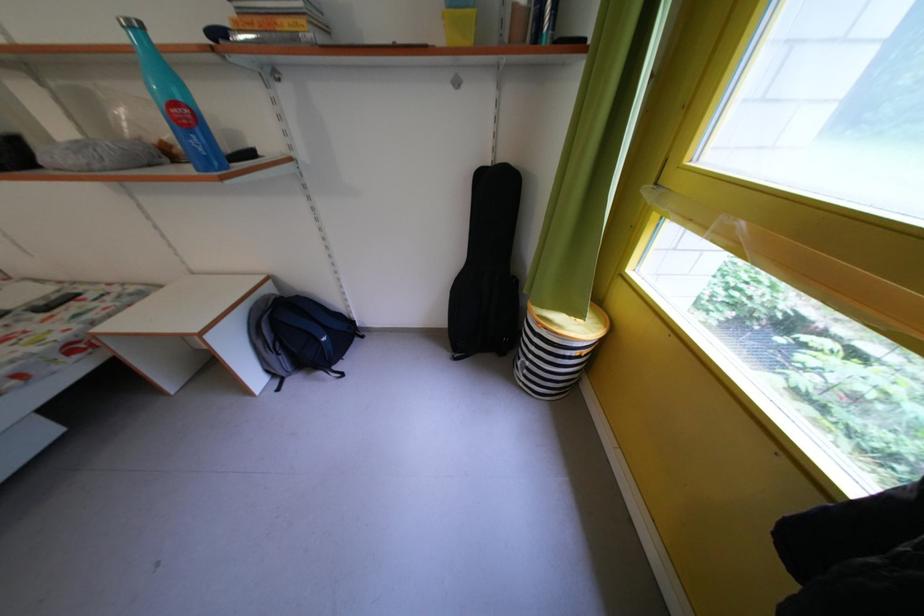
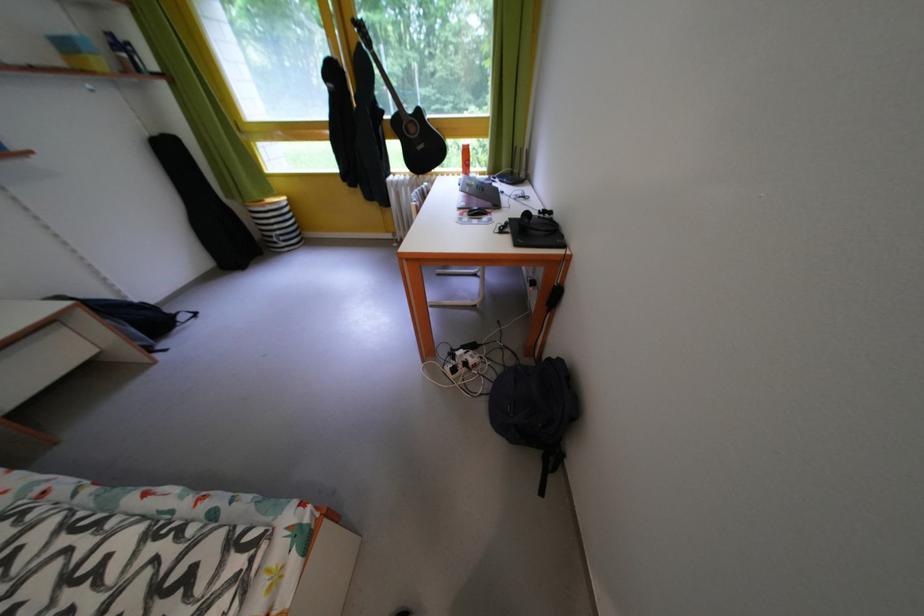
Locate, in the second image, the point that corresponds to (x=537, y=369) in the first image.

(287, 238)